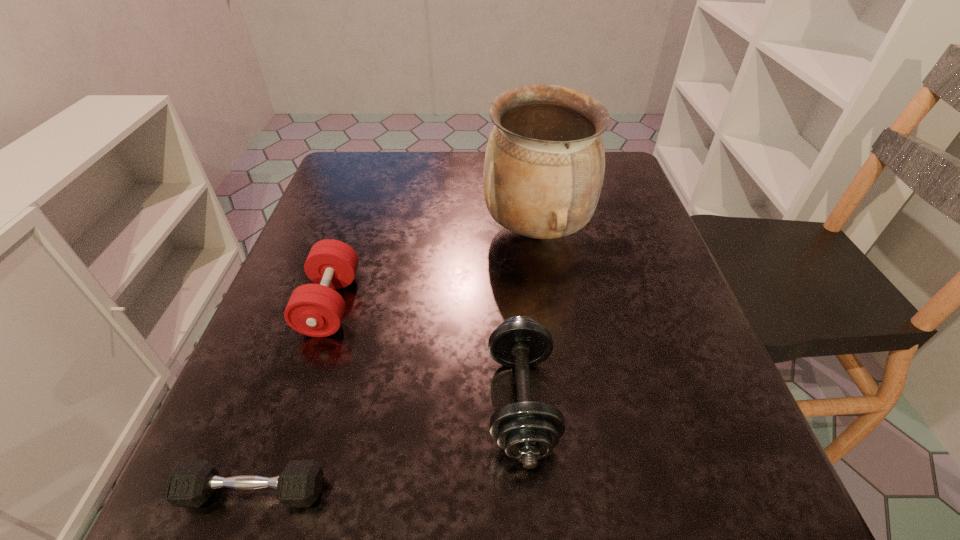
Locate an element on the screen. This screenshot has width=960, height=540. the tallest object is located at coordinates (544, 166).

Find the location of `the rightmost dumbbell`. the rightmost dumbbell is located at coordinates (527, 431).

I want to click on the shortest object, so click(191, 484).

This screenshot has width=960, height=540. What are the coordinates of `vacant space located 0.160m on the left of the urn` in the screenshot? It's located at click(x=409, y=231).

Locate an element on the screen. The height and width of the screenshot is (540, 960). vacant point located 0.220m on the back of the rightmost dumbbell is located at coordinates (510, 253).

What are the coordinates of `vacant space located 0.150m on the back of the shortest object` in the screenshot? It's located at (294, 376).

Locate an element on the screen. This screenshot has width=960, height=540. object located in the far edge section of the desktop is located at coordinates (544, 166).

Locate an element on the screen. The width and height of the screenshot is (960, 540). object located in the right edge section of the desktop is located at coordinates (544, 166).

You are a GUI agent. You are given a task and a screenshot of the screen. Output one action in this format:
    pyautogui.click(x=<x>, y=<y>)
    Task: Click on the object that is at the near left corner
    The image size is (960, 540).
    Given the screenshot: What is the action you would take?
    pyautogui.click(x=191, y=484)

Where is `object positioned at the far right corner`? object positioned at the far right corner is located at coordinates (544, 166).